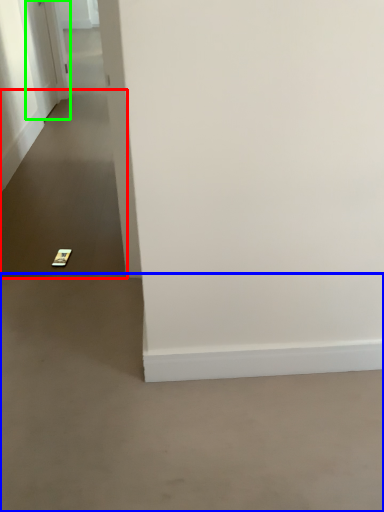
Question: Which is nearer to the path (highlighted by a red box)? concrete (highlighted by a blue box) or door (highlighted by a green box).

Choices:
 (A) concrete
 (B) door

Answer: (B)